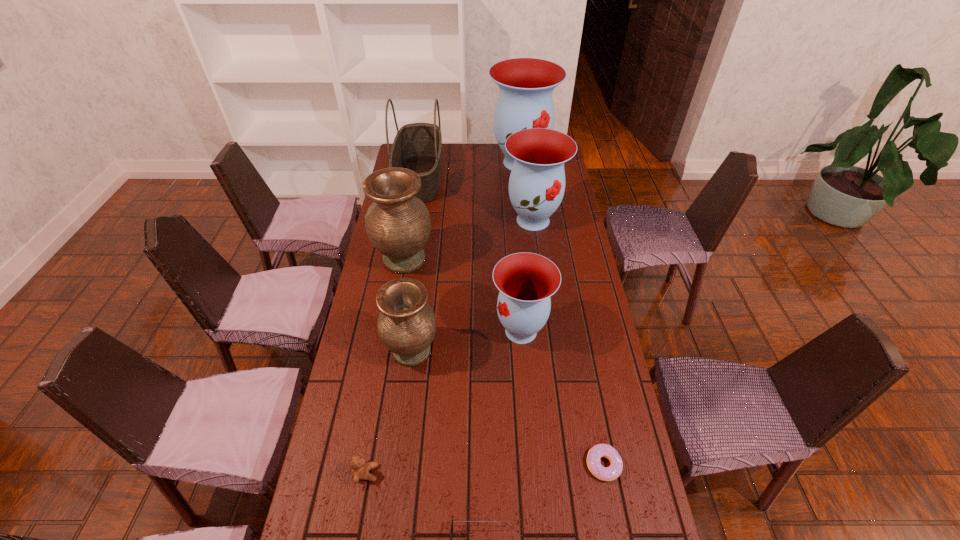
Find the location of `doughnut`. doughnut is located at coordinates (610, 473).

Where is `vacant space situated 0.350m on the left of the tallest object`? vacant space situated 0.350m on the left of the tallest object is located at coordinates (419, 163).

This screenshot has height=540, width=960. In order to click on vacant space located on the front of the basket in this screenshot , I will do `click(411, 232)`.

Identify the location of free region located on the front of the second farthest red vase. (540, 277).

Where is `free space located 0.070m on the back of the bigger green vase`? The height and width of the screenshot is (540, 960). free space located 0.070m on the back of the bigger green vase is located at coordinates (410, 229).

At what (x,y) coordinates should I click in order to perform the action: click on vacant space situated on the front of the nearest red vase. Please return your answer as a coordinate pair (x, y). Looking at the image, I should click on (531, 451).

At what (x,y) coordinates should I click in order to perform the action: click on vacant space located on the right of the nearer green vase. Please return your answer as a coordinate pair (x, y). The width and height of the screenshot is (960, 540). Looking at the image, I should click on (513, 351).

The height and width of the screenshot is (540, 960). In order to click on free location located on the face of the seventh tallest object in this screenshot , I will do `click(514, 473)`.

Locate an element on the screen. This screenshot has height=540, width=960. vacant point located 0.330m on the left of the shortest object is located at coordinates (464, 464).

Identify the location of vase that is at the far edge. The height and width of the screenshot is (540, 960). (526, 85).